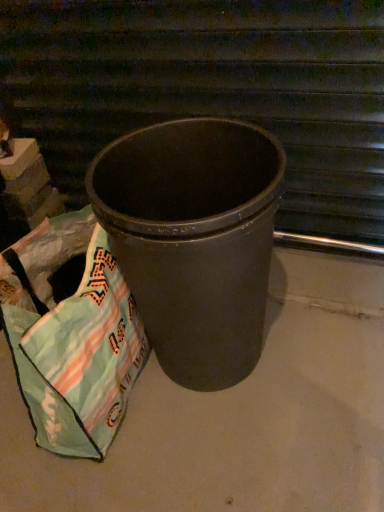
Question: In terms of height, does matte black trash can at center look taller or shorter compared to light green fabric bag at lower left?

Choices:
 (A) tall
 (B) short

Answer: (A)

Question: Looking at the image, does matte black trash can at center seem bigger or smaller compared to light green fabric bag at lower left?

Choices:
 (A) small
 (B) big

Answer: (B)

Question: Which of these objects is positioned farthest from the matte black trash can at center?

Choices:
 (A) matte gray concrete at center
 (B) light green fabric bag at lower left
 (C) matte black trash can at center

Answer: (C)

Question: Based on their relative distances, which object is nearer to the matte black trash can at center?

Choices:
 (A) matte gray concrete at center
 (B) light green fabric bag at lower left
 (C) matte black trash can at center

Answer: (C)